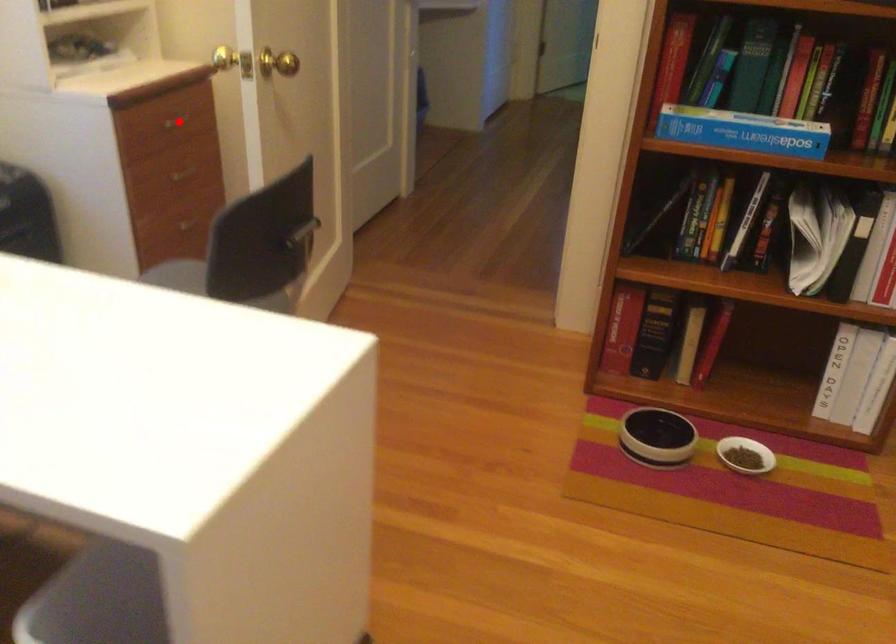
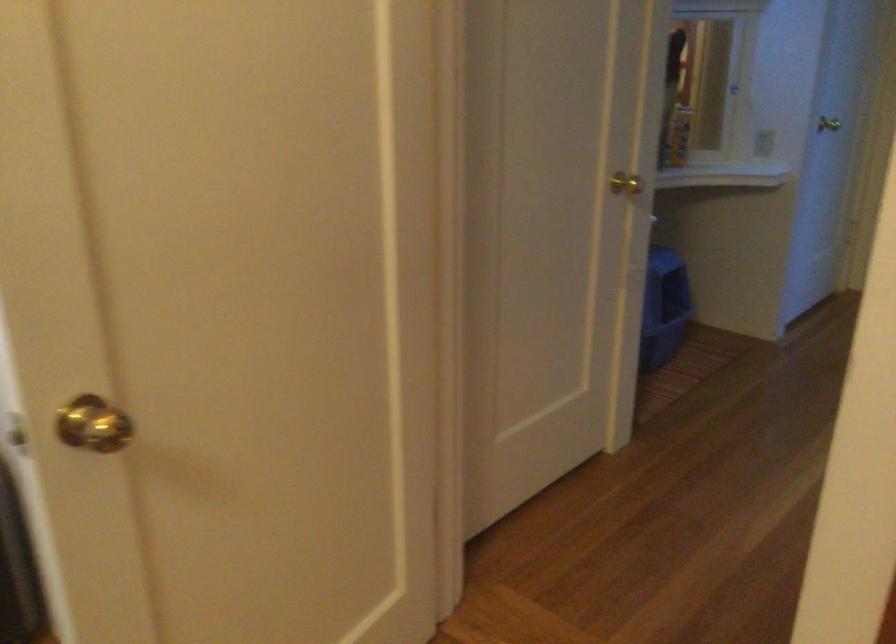
Question: I am providing you with two images of the same scene from different viewpoints. A red point is marked on the first image. At the location where the point appears in image 1, is it still visible in image 2?

Choices:
 (A) Yes
 (B) No

Answer: (B)